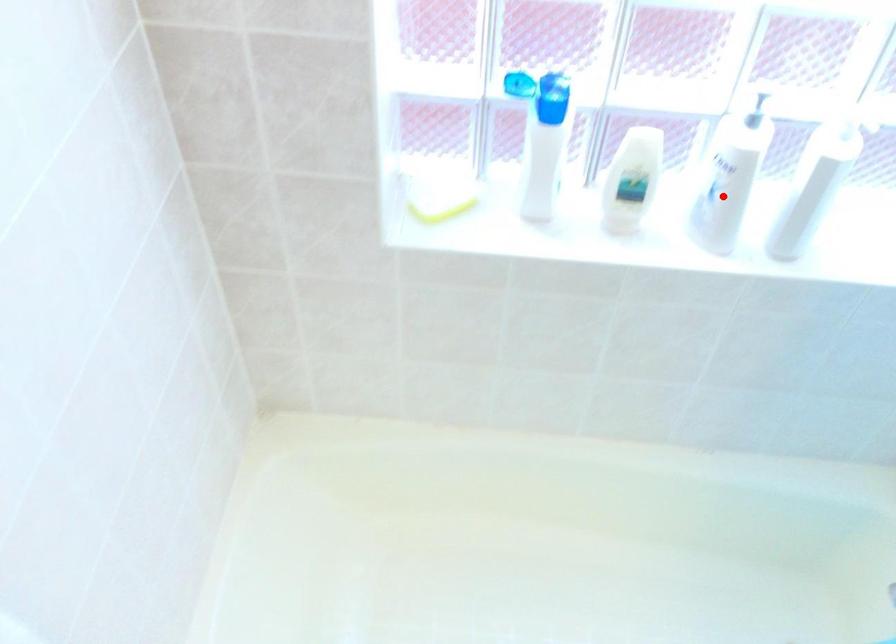
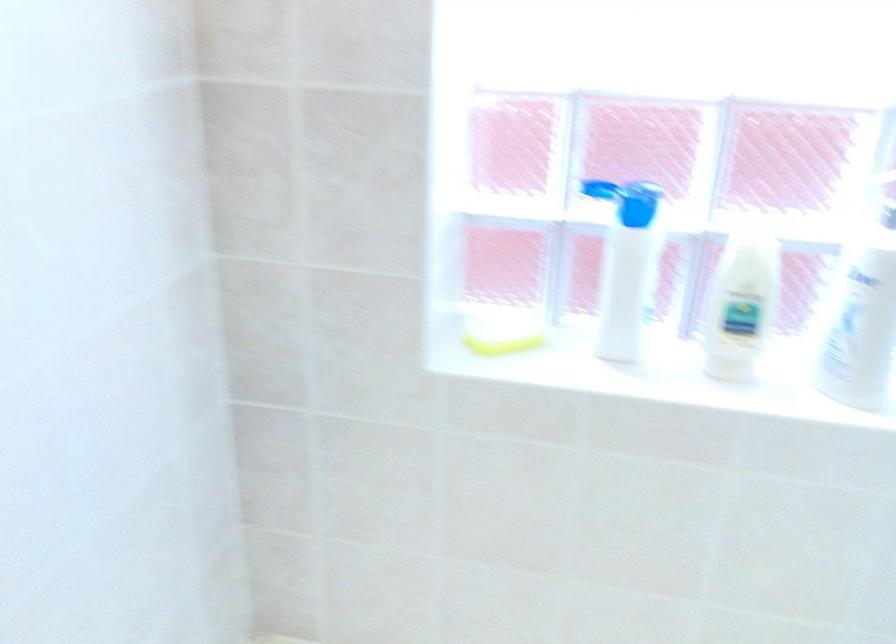
In the second image, find the point that corresponds to the highlighted location in the first image.

(860, 323)